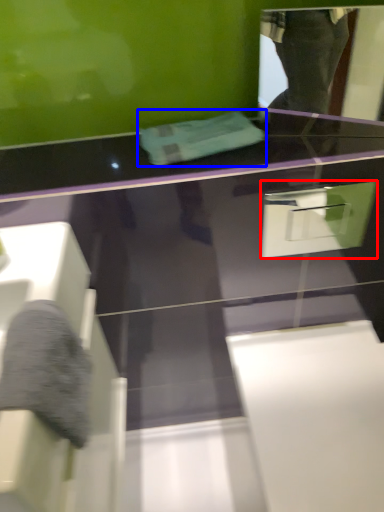
Question: Which of the following is the closest to the observer, drawer (highlighted by a red box) or towel (highlighted by a blue box)?

Choices:
 (A) drawer
 (B) towel

Answer: (A)